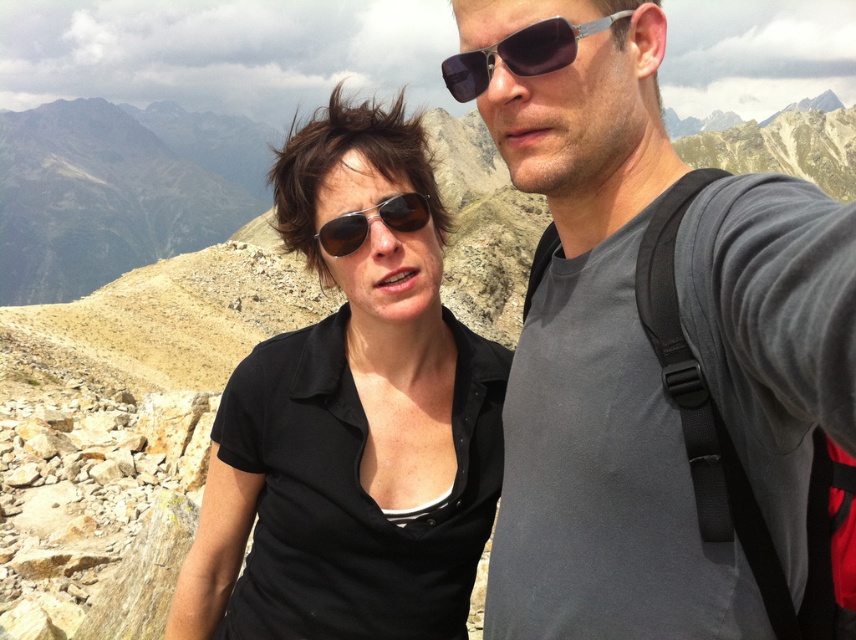
Question: Which point is farther to the camera?

Choices:
 (A) (571, 45)
 (B) (395, 218)
 (C) (456, 56)
 (D) (265, 506)

Answer: (D)

Question: Observing the image, what is the correct spatial positioning of gray matte t-shirt at center in reference to sunglasses at center?

Choices:
 (A) below
 (B) above

Answer: (A)

Question: Is sunglasses at center positioned in front of matte black sunglasses at center?

Choices:
 (A) no
 (B) yes

Answer: (B)

Question: Among these objects, which one is farthest from the camera?

Choices:
 (A) black matte shirt at center
 (B) gray matte t-shirt at center
 (C) matte black sunglasses at center

Answer: (C)

Question: From the image, what is the correct spatial relationship of sunglasses at center in relation to matte black sunglasses at center?

Choices:
 (A) right
 (B) left

Answer: (A)

Question: Among these points, which one is farthest from the camera?

Choices:
 (A) (526, 76)
 (B) (349, 224)
 (C) (556, 548)
 (D) (284, 512)

Answer: (B)